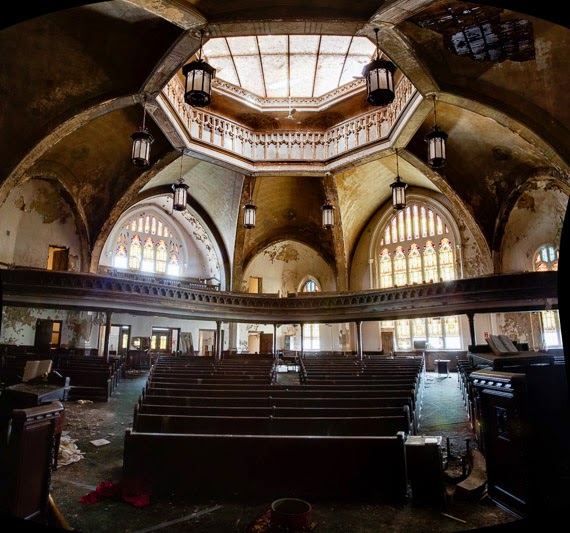
In order to click on window glass in this screenshot , I will do `click(158, 337)`.